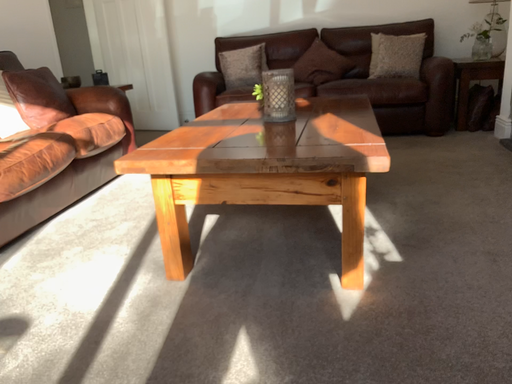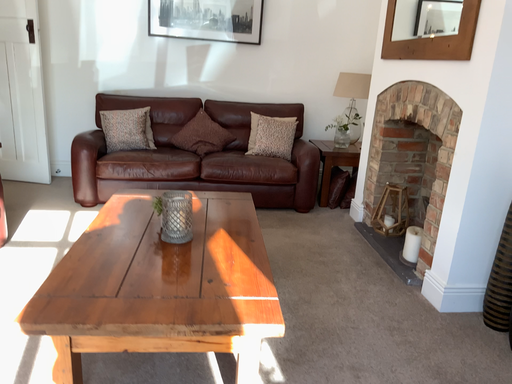
Question: Which way did the camera rotate in the video?

Choices:
 (A) rotated left
 (B) rotated right

Answer: (B)